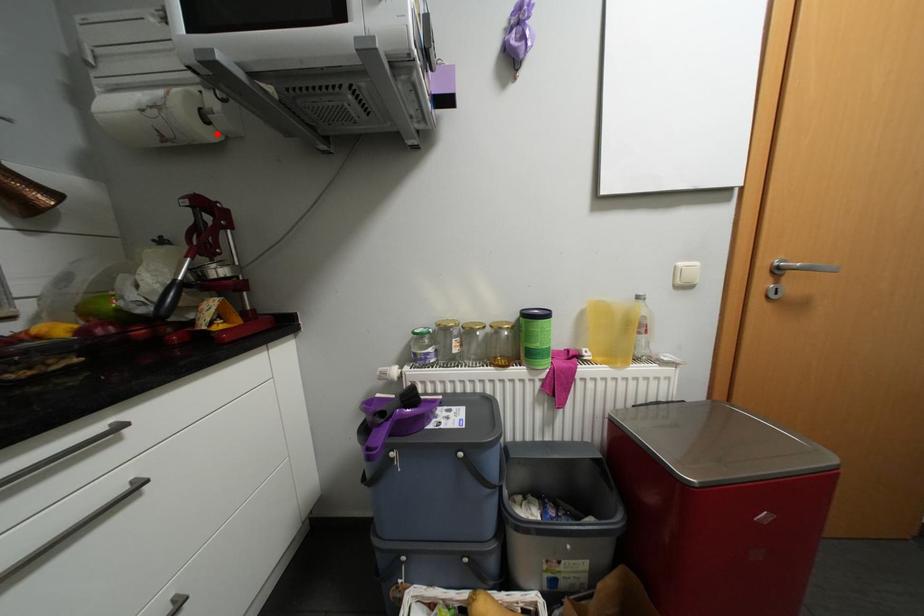
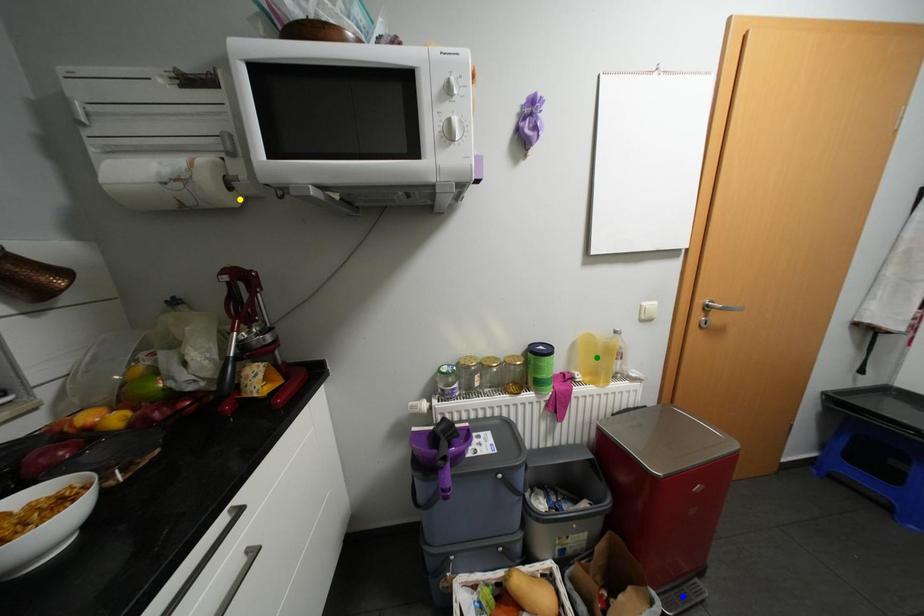
Question: I am providing you with two images of the same scene from different viewpoints. A red point is marked on the first image. You are given multiple points on the second image. In image 2, which mark is for the same physical point as the one in image 1?

Choices:
 (A) blue point
 (B) green point
 (C) yellow point

Answer: (C)